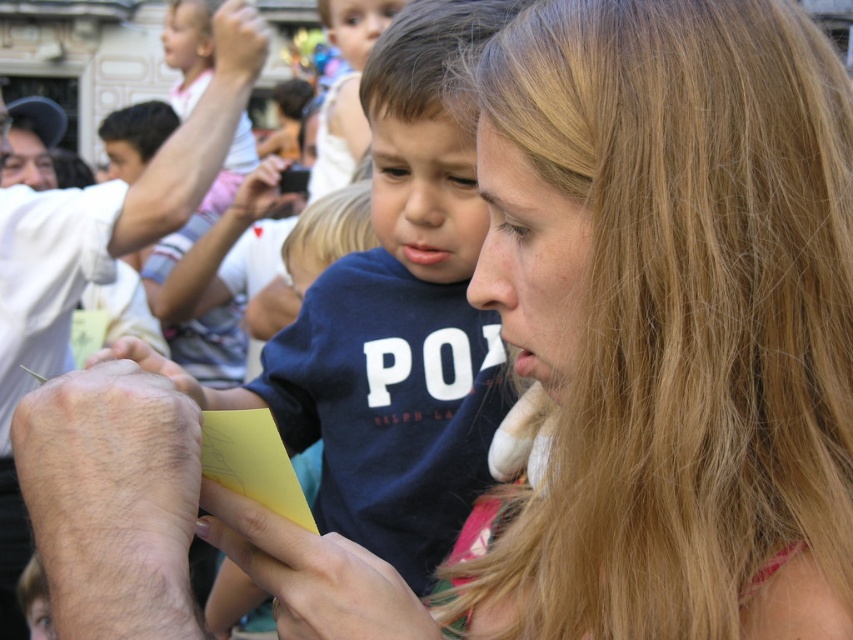
Question: Among these objects, which one is nearest to the camera?

Choices:
 (A) hairy skin at lower left
 (B) blue cotton shirt at center
 (C) dark brown hair at upper left

Answer: (B)

Question: Is blonde smooth hair at center further to camera compared to dark brown hair at upper left?

Choices:
 (A) yes
 (B) no

Answer: (B)

Question: Based on their relative distances, which object is farther from the hairy skin at lower left?

Choices:
 (A) dark brown hair at upper left
 (B) blonde smooth hair at center

Answer: (A)

Question: Is blonde smooth hair at center positioned before dark brown hair at upper left?

Choices:
 (A) yes
 (B) no

Answer: (A)

Question: Which point is farther to the camera?

Choices:
 (A) (108, 129)
 (B) (322, 211)
 (C) (231, 74)

Answer: (A)

Question: Can you confirm if blue cotton shirt at center is bigger than blonde smooth hair at center?

Choices:
 (A) yes
 (B) no

Answer: (A)